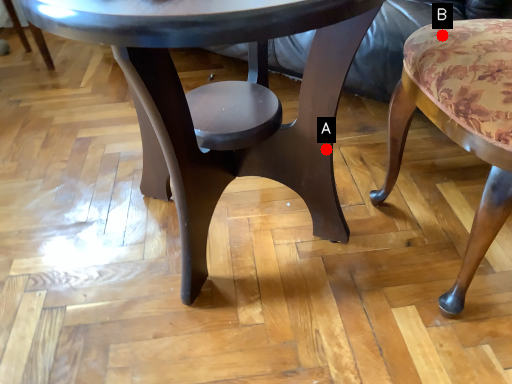
Question: Two points are circled on the image, labeled by A and B beside each circle. Which point appears closest to the camera in this image?

Choices:
 (A) A is closer
 (B) B is closer

Answer: (B)